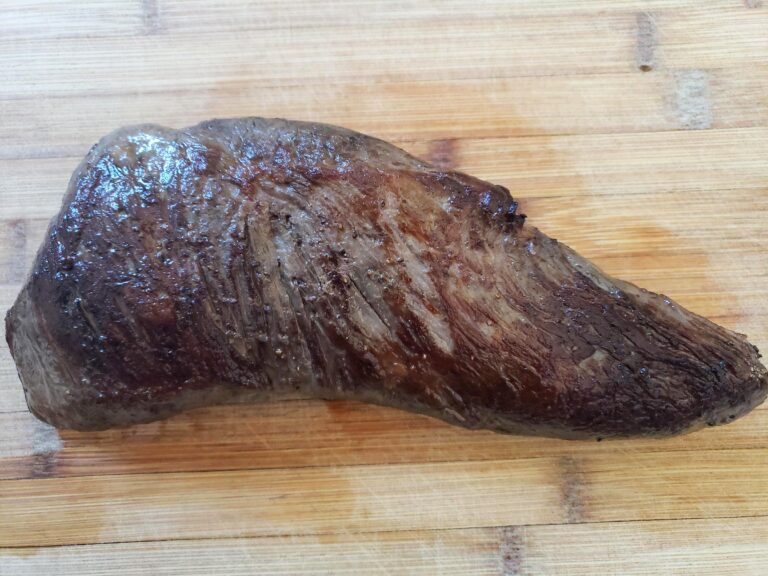
This screenshot has width=768, height=576. I want to click on wood grain, so coord(143,481).